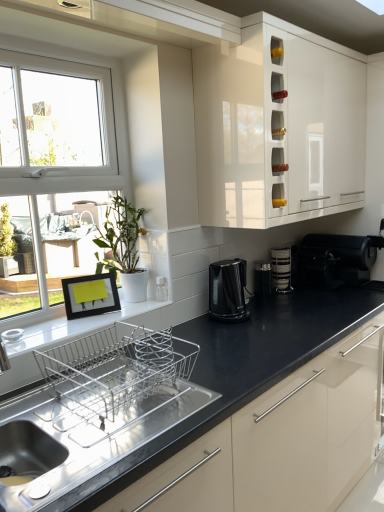
Question: Is point (286, 289) closer or farther from the camera than point (259, 266)?

Choices:
 (A) closer
 (B) farther

Answer: (B)

Question: Considering their positions, is stacked plates at center located in front of or behind black plastic toaster at center, which appears as the second appliance when viewed from the left?

Choices:
 (A) front
 (B) behind

Answer: (B)

Question: Estimate the real-world distances between objects in this image. Which object is closer to the white glossy window sill at lower left?

Choices:
 (A) white glossy cabinet at upper center
 (B) black glossy electric kettle at center
 (C) stacked plates at center
 (D) stainless steel sink at lower left
 (E) black plastic toaster at center, which appears as the second appliance when viewed from the left

Answer: (D)

Question: Which of these objects is positioned closest to the matte white coffee maker at upper center, which is the first appliance in left-to-right order?

Choices:
 (A) black plastic toaster at center, the 2th appliance when ordered from right to left
 (B) white glossy window sill at lower left
 (C) black plastic toaster at right, which is the second appliance from back to front
 (D) white glossy cabinet at upper center
 (E) green leafy plant at left

Answer: (E)